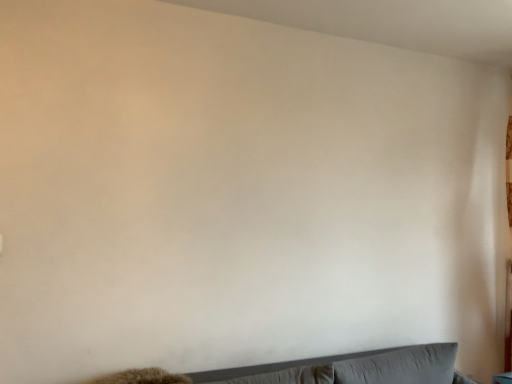
Question: Is gray fabric couch at lower center turned away from gray fabric pillow at lower right, arranged as the first pillow when viewed from the right?

Choices:
 (A) no
 (B) yes

Answer: (B)

Question: Can you confirm if gray fabric couch at lower center is taller than gray fabric pillow at lower right, which appears as the second pillow when viewed from the left?

Choices:
 (A) no
 (B) yes

Answer: (B)

Question: Is the position of gray fabric couch at lower center less distant than that of gray fabric pillow at lower right, which appears as the second pillow when viewed from the left?

Choices:
 (A) yes
 (B) no

Answer: (A)

Question: Is gray fabric couch at lower center to the left of gray fabric pillow at lower right, which appears as the second pillow when viewed from the left, from the viewer's perspective?

Choices:
 (A) yes
 (B) no

Answer: (A)

Question: Is gray fabric couch at lower center far away from gray fabric pillow at lower right, which appears as the second pillow when viewed from the left?

Choices:
 (A) yes
 (B) no

Answer: (B)

Question: From a real-world perspective, is gray fabric couch at lower center beneath gray fabric pillow at lower right, which appears as the second pillow when viewed from the left?

Choices:
 (A) yes
 (B) no

Answer: (A)

Question: From a real-world perspective, is gray fabric pillow at lower center, acting as the 2th pillow starting from the right, on top of gray fabric couch at lower center?

Choices:
 (A) no
 (B) yes

Answer: (B)

Question: Is gray fabric pillow at lower center, acting as the 2th pillow starting from the right, outside gray fabric couch at lower center?

Choices:
 (A) no
 (B) yes

Answer: (A)

Question: Is gray fabric pillow at lower center, acting as the 2th pillow starting from the right, not near gray fabric couch at lower center?

Choices:
 (A) no
 (B) yes

Answer: (A)

Question: Considering the relative sizes of gray fabric pillow at lower center, the 1th pillow viewed from the left, and gray fabric couch at lower center in the image provided, is gray fabric pillow at lower center, the 1th pillow viewed from the left, smaller than gray fabric couch at lower center?

Choices:
 (A) no
 (B) yes

Answer: (B)

Question: Does gray fabric pillow at lower center, the 1th pillow viewed from the left, have a greater width compared to gray fabric couch at lower center?

Choices:
 (A) yes
 (B) no

Answer: (B)

Question: Does gray fabric pillow at lower center, the 1th pillow viewed from the left, contain gray fabric couch at lower center?

Choices:
 (A) no
 (B) yes

Answer: (A)

Question: Considering the relative sizes of gray fabric couch at lower center and gray fabric pillow at lower center, acting as the 2th pillow starting from the right, in the image provided, is gray fabric couch at lower center smaller than gray fabric pillow at lower center, acting as the 2th pillow starting from the right,?

Choices:
 (A) yes
 (B) no

Answer: (B)